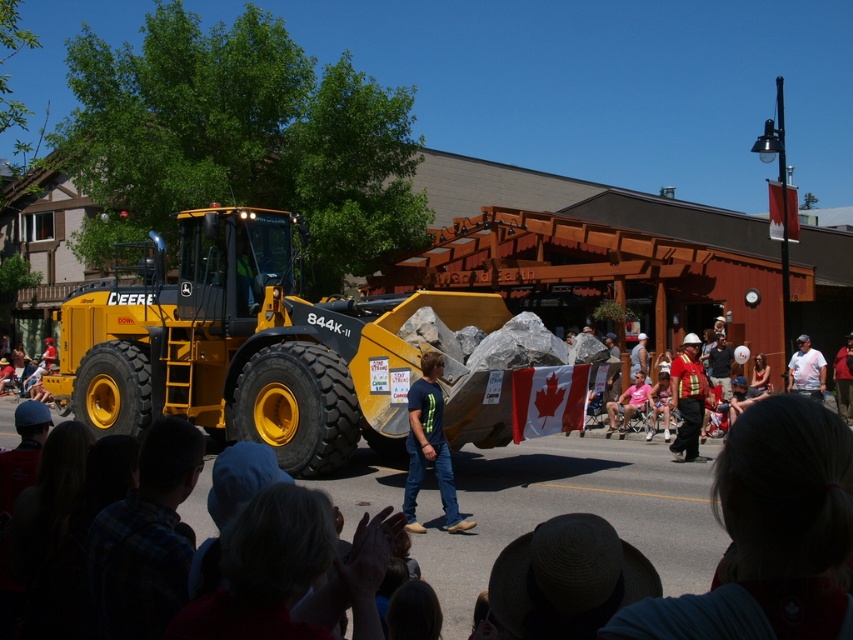
Question: Which is farther from the yellow metallic tractor at center?

Choices:
 (A) dark blue t-shirt at center
 (B) red uniform at center

Answer: (B)

Question: Which of the following is the farthest from the observer?

Choices:
 (A) yellow metallic tractor at center
 (B) dark blue t-shirt at center

Answer: (A)

Question: Can you confirm if dark blue t-shirt at center is positioned to the right of white t-shirt at center?

Choices:
 (A) yes
 (B) no

Answer: (B)

Question: Does red uniform at center have a larger size compared to white t-shirt at center?

Choices:
 (A) yes
 (B) no

Answer: (B)

Question: Which of these objects is positioned farthest from the dark blue t-shirt at center?

Choices:
 (A) yellow metallic tractor at center
 (B) white t-shirt at center
 (C) red uniform at center

Answer: (B)

Question: Is yellow metallic tractor at center to the left of white t-shirt at center from the viewer's perspective?

Choices:
 (A) no
 (B) yes

Answer: (B)